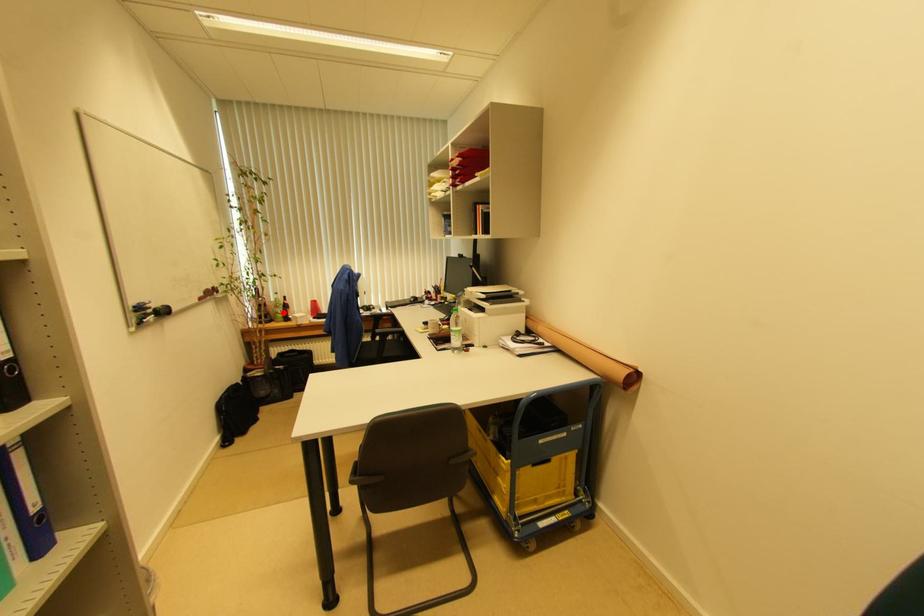
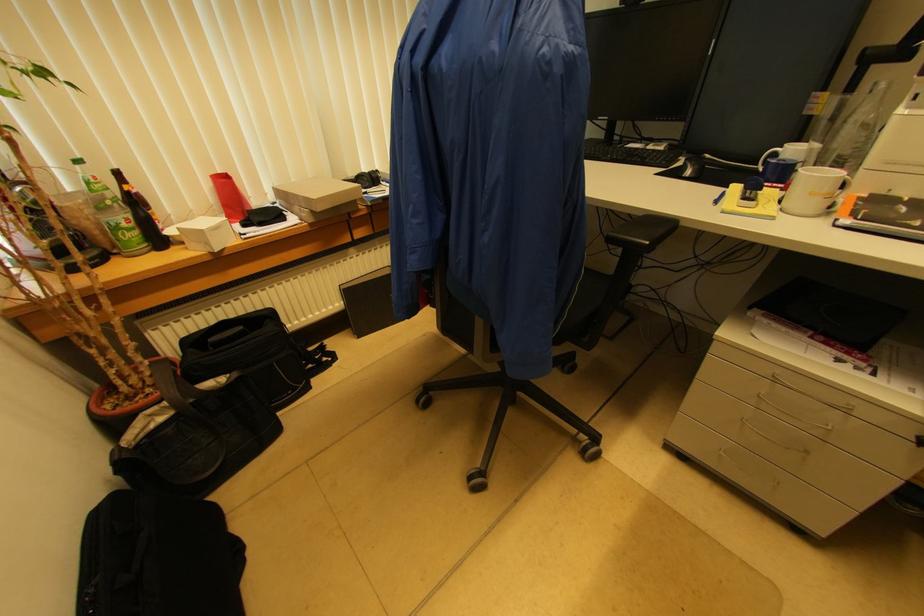
Locate, in the second image, the point that corresponds to the highlighted location in the first image.

(131, 219)